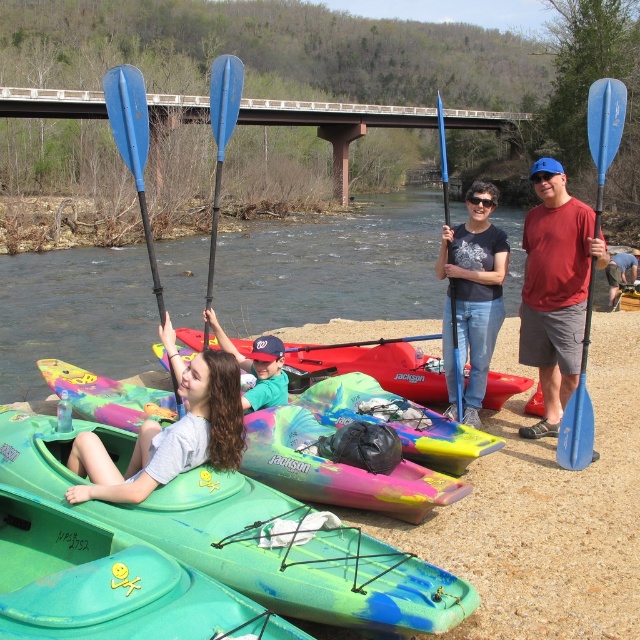
You are standing at the riverbank and want to take a photo of the two points marked in the scene. Which point, point 1 at coordinates (276, 476) or point 2 at coordinates (448, 186), will appear larger in your photo?

Point 1 at coordinates (276, 476) will appear larger in the photo because it is closer to the camera than point 2 at coordinates (448, 186).

You are a photographer positioned at the riverbank. You need to capture a photo of the green plastic kayak at lower left and the blue plastic paddle at right. Based on their positions, which object would appear closer to the bottom of the photo?

The green plastic kayak at lower left is located below the blue plastic paddle at right, so it would appear closer to the bottom of the photo.